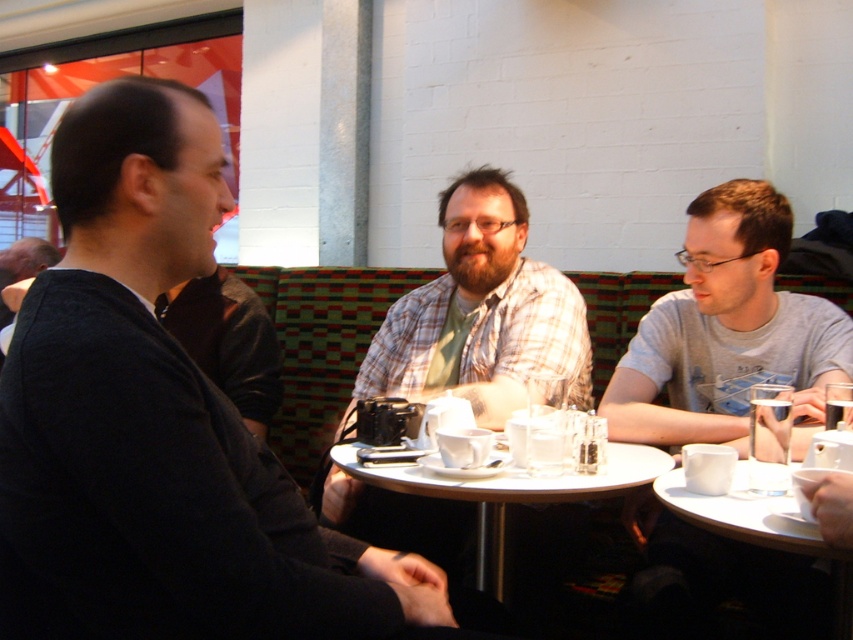
Question: Which of the following is the farthest from the observer?

Choices:
 (A) dark gray sweater at left
 (B) clear glass cup at lower right

Answer: (B)

Question: Does dark gray sweater at left appear on the right side of clear glass cup at lower right?

Choices:
 (A) no
 (B) yes

Answer: (A)

Question: Is dark gray sweater at left thinner than gray cotton shirt at right?

Choices:
 (A) no
 (B) yes

Answer: (B)

Question: Can you confirm if white ceramic table at lower right is wider than clear glass cup at lower right?

Choices:
 (A) yes
 (B) no

Answer: (A)

Question: Estimate the real-world distances between objects in this image. Which object is farther from the white ceramic table at lower right?

Choices:
 (A) clear glass cup at lower right
 (B) gray cotton shirt at right
 (C) dark gray sweater at left
 (D) white glossy table at center

Answer: (C)

Question: Which point appears farthest from the camera in this image?

Choices:
 (A) (77, 280)
 (B) (717, 243)
 (C) (749, 454)
 (D) (764, 509)

Answer: (B)